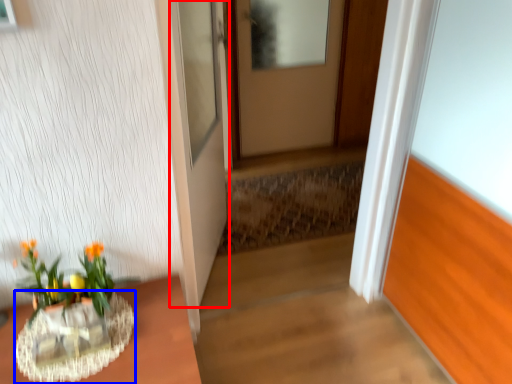
Question: Among these objects, which one is farthest to the camera, door (highlighted by a red box) or vase (highlighted by a blue box)?

Choices:
 (A) door
 (B) vase

Answer: (A)